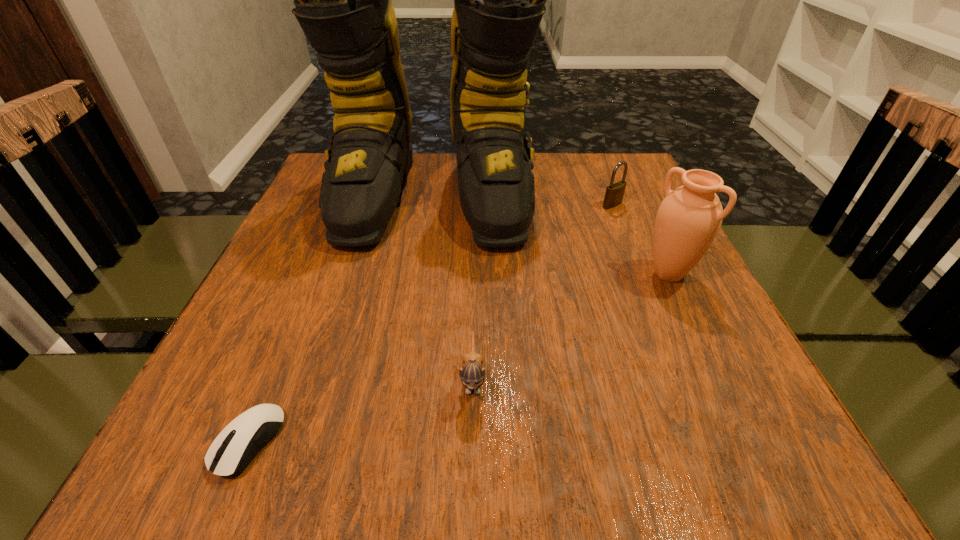
Where is `empty space that is in between the mouse and the padlock`? Image resolution: width=960 pixels, height=540 pixels. empty space that is in between the mouse and the padlock is located at coordinates (430, 323).

Identify the location of free point between the shortest object and the third tallest object. (430, 323).

Identify the location of vacant space that's between the second shortest object and the fourth shortest object. (570, 326).

This screenshot has height=540, width=960. Find the location of `free space between the urn and the kitten`. free space between the urn and the kitten is located at coordinates (570, 326).

In order to click on object identified as the second closest to the kitten in this screenshot , I will do `click(234, 448)`.

Locate which object is the second closest to the shortest object. Please provide its 2D coordinates. Your answer should be formatted as a tuple, i.e. [(x, y)], where the tuple contains the x and y coordinates of a point satisfying the conditions above.

[(343, 0)]

Identify the location of blank space that satisfies the following two spatial constraints: 1. on the front side of the ski boots; 2. on the left side of the urn. (420, 274).